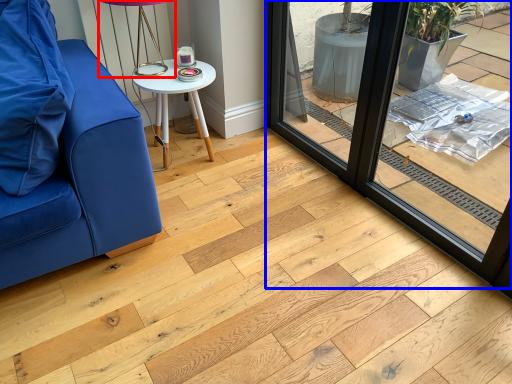
Question: Which object is further to the camera taking this photo, table lamp (highlighted by a red box) or window frame (highlighted by a blue box)?

Choices:
 (A) table lamp
 (B) window frame

Answer: (A)